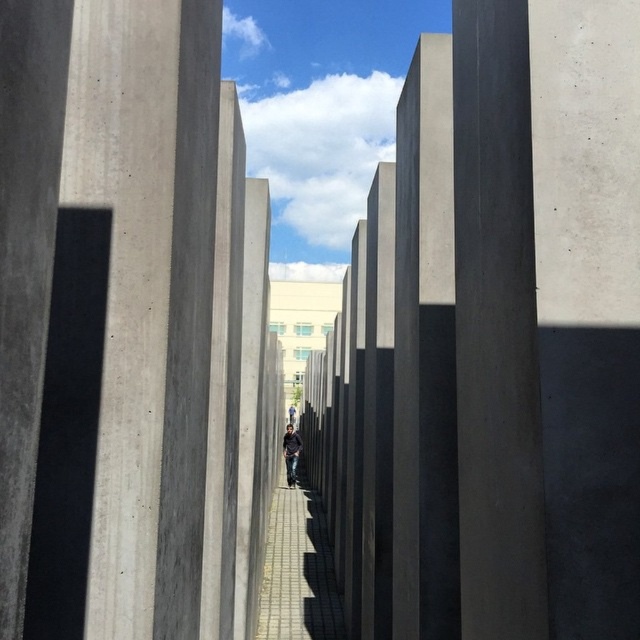
You are standing on the walkway between the pillars and see the smooth concrete pillar at center and the dark blue jeans at center. Which object is higher from the ground?

The smooth concrete pillar at center is above dark blue jeans at center, so the smooth concrete pillar at center is higher from the ground.

You are standing on the walkway between the pillars and want to take a photo of both the point at coordinates (280, 516) and the point at coordinates (289, 435). Which point will appear larger in your camera view?

Point at coordinates (280, 516) will appear larger in the camera view because it is closer to the camera than point at coordinates (289, 435).

You are standing on the walkway between the pillars and want to reach the pale yellow building in the background. Which direction should you move relative to the smooth concrete pillar at center and the dark blue jeans at center?

The smooth concrete pillar at center is to the right of the dark blue jeans at center. To reach the pale yellow building in the background, you should move forward towards the direction away from the smooth concrete pillar at center and the dark blue jeans at center, as the building is in the background behind them.